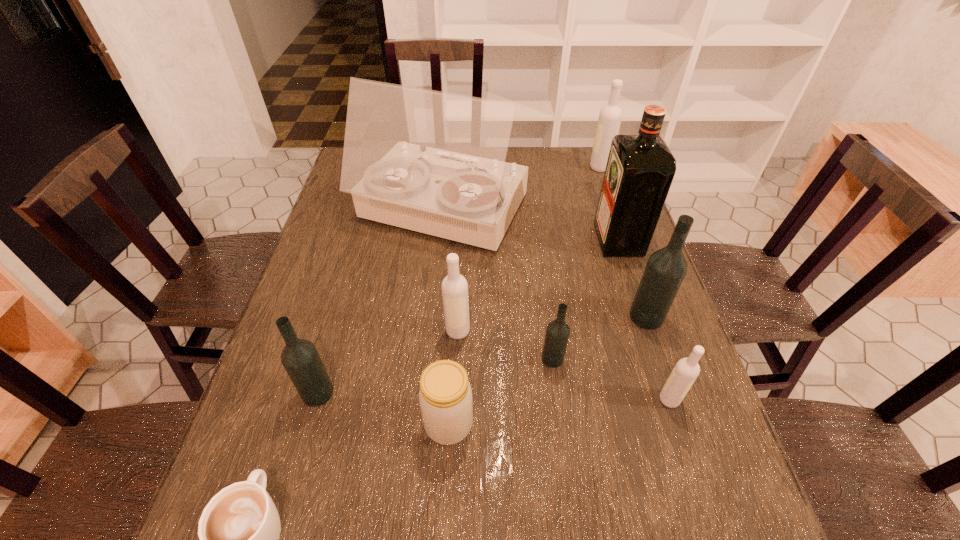
Where is `object present at the far left corner`? The image size is (960, 540). object present at the far left corner is located at coordinates (433, 162).

Identify the location of object that is positioned at the far right corner. (610, 116).

Find the location of a particular element. This screenshot has width=960, height=540. vacant space at the far edge is located at coordinates (541, 146).

You are a GUI agent. You are given a task and a screenshot of the screen. Output one action in this format:
    pyautogui.click(x=<x>, y=<y>)
    Task: Click on the vacant space at the left edge
    Image resolution: width=960 pixels, height=540 pixels.
    Given the screenshot: What is the action you would take?
    pyautogui.click(x=355, y=315)

Locate an element on the screen. Image resolution: width=960 pixels, height=540 pixels. vacant region at the right edge of the desktop is located at coordinates (641, 268).

Image resolution: width=960 pixels, height=540 pixels. In order to click on free space between the leftmost black vodka and the rightmost black vodka in this screenshot , I will do `click(482, 355)`.

Where is `free space between the biggest black vodka and the leftmost black vodka`? free space between the biggest black vodka and the leftmost black vodka is located at coordinates (482, 355).

In order to click on vacant region between the white record player and the smallest white vodka in this screenshot , I will do `click(556, 305)`.

The width and height of the screenshot is (960, 540). I want to click on vacant space that's between the biggest white vodka and the nearest white vodka, so click(x=635, y=284).

Where is `free spot between the liquor and the second farthest black vodka`? free spot between the liquor and the second farthest black vodka is located at coordinates (586, 299).